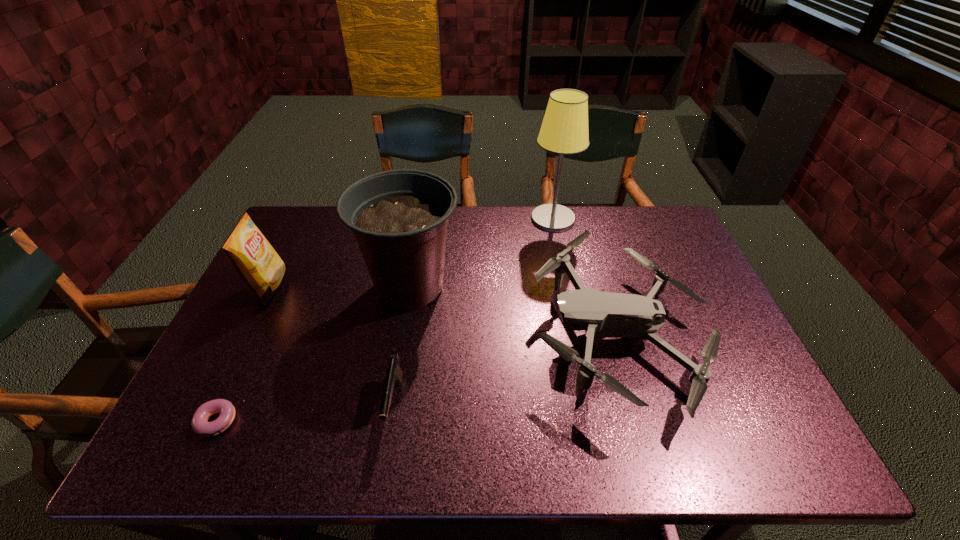
Identify the location of vacant space located 0.210m with a camera at the front of the third shortest object. Image resolution: width=960 pixels, height=540 pixels. (448, 335).

Locate an element on the screen. This screenshot has width=960, height=540. vacant space located with a camera at the front of the third shortest object is located at coordinates (460, 335).

Where is `vacant space located 0.230m with a camera at the front of the third shortest object`? The width and height of the screenshot is (960, 540). vacant space located 0.230m with a camera at the front of the third shortest object is located at coordinates (441, 335).

Locate an element on the screen. The width and height of the screenshot is (960, 540). vacant area located on the back of the shortest object is located at coordinates (257, 340).

Image resolution: width=960 pixels, height=540 pixels. Identify the location of object that is at the far edge. (564, 130).

I want to click on drone that is positioned at the near edge, so click(601, 315).

What are the coordinates of `pistol located in the near edge section of the desktop` in the screenshot? It's located at (394, 374).

Locate an element on the screen. doughnut located at the near edge is located at coordinates tap(200, 426).

You are a GUI agent. You are given a task and a screenshot of the screen. Output one action in this format:
    pyautogui.click(x=<x>, y=<y>)
    Task: Click on the crisp (potato chip) that is at the left edge
    Image resolution: width=960 pixels, height=540 pixels.
    Given the screenshot: What is the action you would take?
    pyautogui.click(x=257, y=264)

Where is `doughnut that is positioned at the left edge`? This screenshot has height=540, width=960. doughnut that is positioned at the left edge is located at coordinates (200, 426).